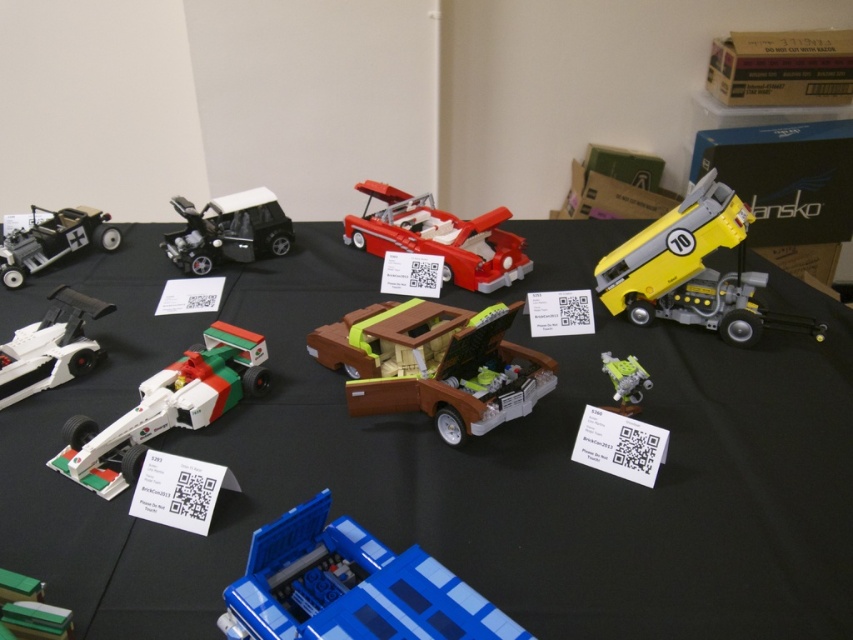
You are a LEGO enthusiast at the exhibition. You see the black matte car at center and the matte black car at left. Which one is closer to you?

The black matte car at center is closer to you because the matte black car at left is behind it.

You are at a LEGO exhibition and see two cars displayed on a table. The first is the black matte car at center, and the second is the matte black car at left. Which of these two cars is positioned more to the left on the table?

The matte black car at left is positioned more to the left on the table than the black matte car at center.